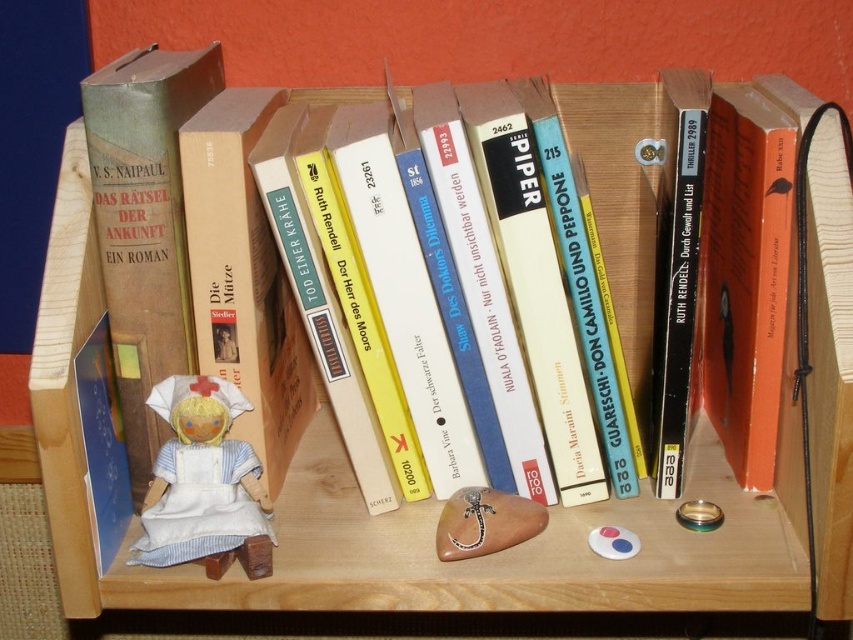
You are a child trying to reach both the white fabric doll at center and the brown wooden spoon at center on a wooden bookshelf. If your hand can only extend 15 centimeters, can you grab both items at the same time?

The distance between the white fabric doll at center and the brown wooden spoon at center is 18.32 centimeters. Since your hand can only extend 15 centimeters, you cannot grab both items at the same time.

You are organizing a small display on a wooden bookshelf. You have a white fabric doll at center and a brown wooden spoon at center. Based on their positions, which object is placed higher up?

The white fabric doll at center is above the brown wooden spoon at center, so it is placed higher up.